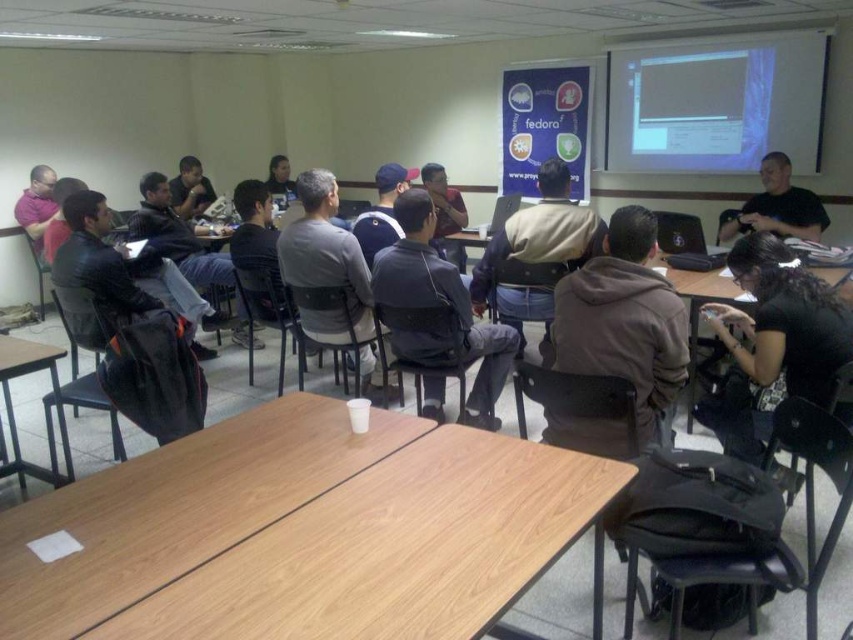
Does wooden table at center have a smaller size compared to matte black shirt at upper center?

Correct, wooden table at center occupies less space than matte black shirt at upper center.

Is wooden table at center thinner than matte black shirt at upper center?

In fact, wooden table at center might be wider than matte black shirt at upper center.

Describe the element at coordinates (178, 509) in the screenshot. This screenshot has width=853, height=640. I see `wooden table at center` at that location.

This screenshot has width=853, height=640. What are the coordinates of `wooden table at center` in the screenshot? It's located at (178, 509).

Does wooden table at center appear on the right side of matte black shirt at center?

Correct, you'll find wooden table at center to the right of matte black shirt at center.

Based on the photo, between wooden table at center and matte black shirt at center, which one appears on the left side from the viewer's perspective?

Positioned to the left is matte black shirt at center.

Between point (131, 509) and point (175, 200), which one is positioned in front?

Point (131, 509) is more forward.

You are a GUI agent. You are given a task and a screenshot of the screen. Output one action in this format:
    pyautogui.click(x=<x>, y=<y>)
    Task: Click on the wooden table at center
    The height and width of the screenshot is (640, 853).
    Given the screenshot: What is the action you would take?
    pyautogui.click(x=178, y=509)

Is the position of leather jacket at left more distant than that of matte black shirt at upper center?

No.

Is leather jacket at left thinner than matte black shirt at upper center?

Incorrect, leather jacket at left's width is not less than matte black shirt at upper center's.

This screenshot has height=640, width=853. What do you see at coordinates (125, 268) in the screenshot? I see `leather jacket at left` at bounding box center [125, 268].

Find the location of a particular element. leather jacket at left is located at coordinates (125, 268).